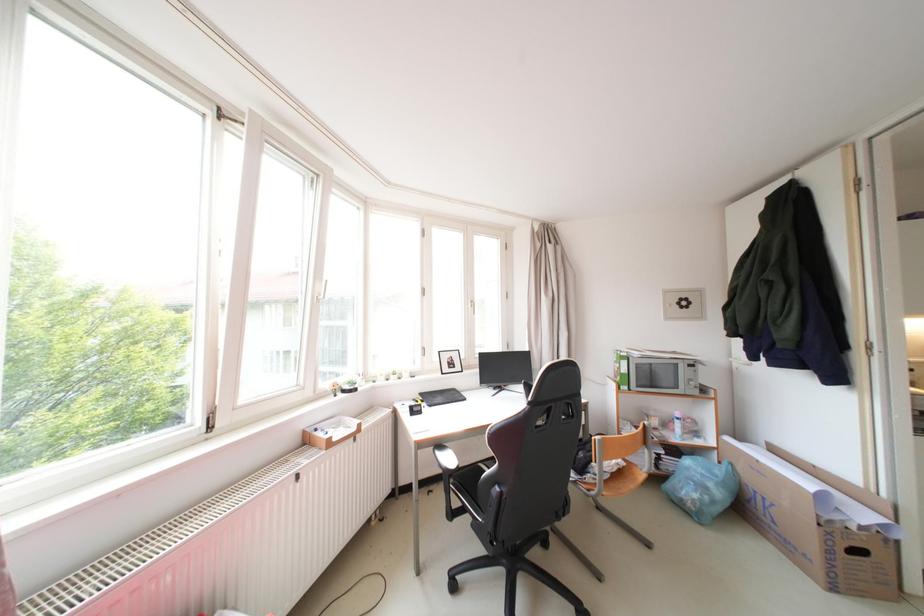
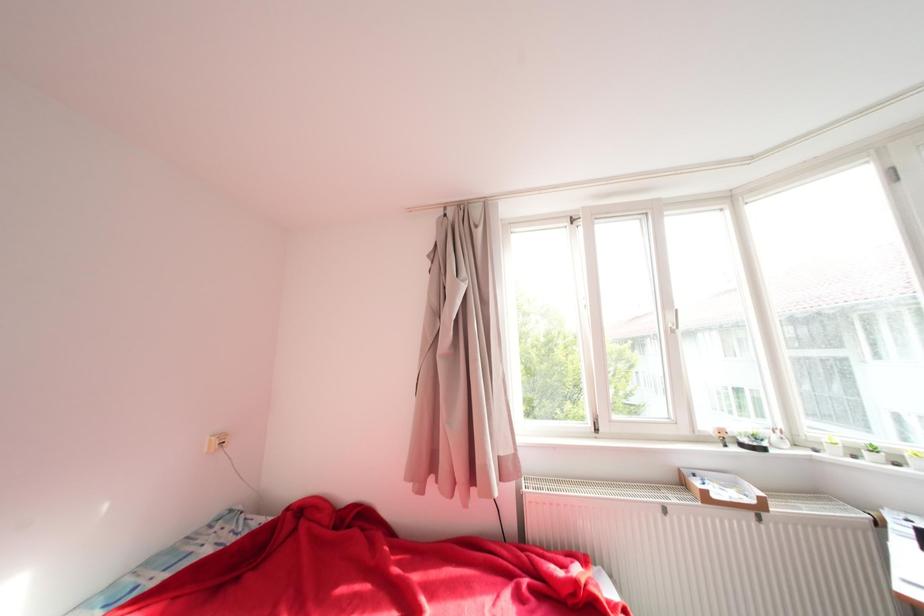
Question: The camera is either moving clockwise (left) or counter-clockwise (right) around the object. The first image is from the beginning of the video and the second image is from the end. Is the camera moving left or right when shooting the video?

Choices:
 (A) Left
 (B) Right

Answer: (B)